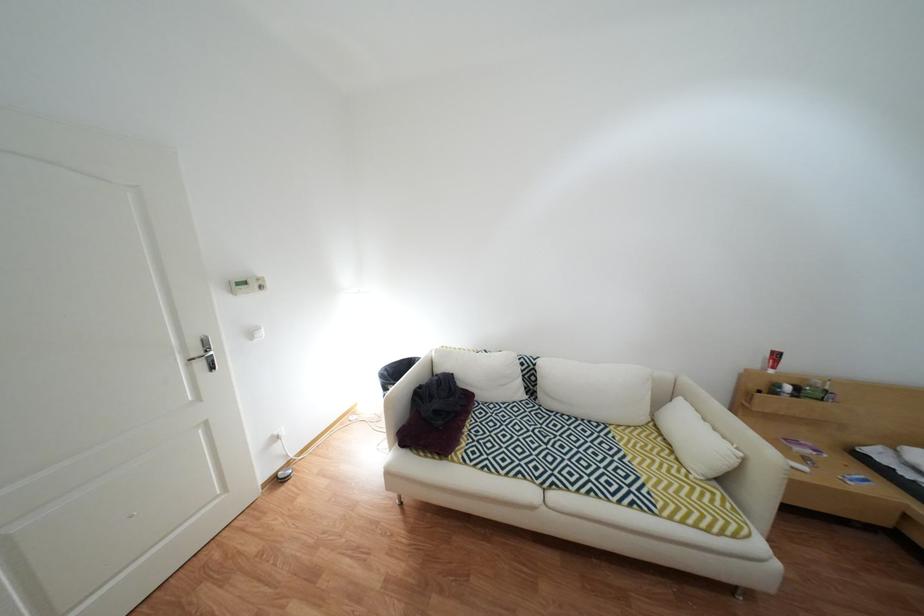
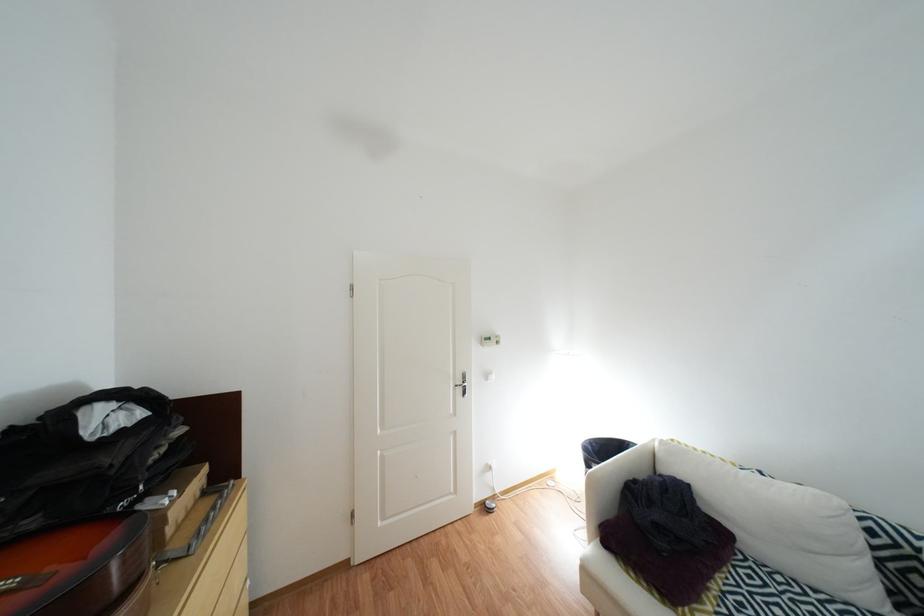
Question: Based on the continuous images, in which direction is the camera rotating? Reply with the corresponding letter.

Choices:
 (A) Left
 (B) Right
 (C) Up
 (D) Down

Answer: (A)